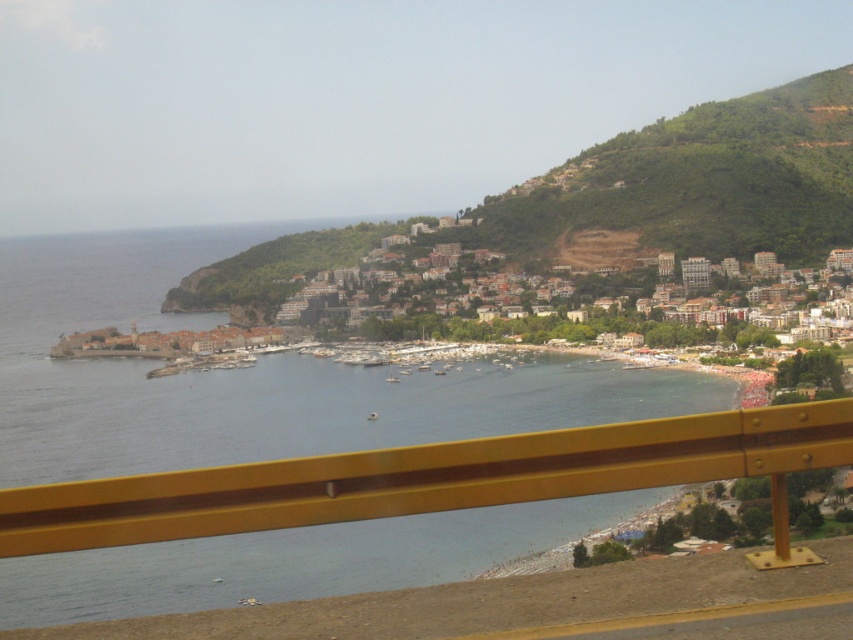
You are a photographer standing at the viewpoint with a wide angle lens. You want to capture both the yellow metallic rail at lower center and the brown stone buildings at center in the same frame. Considering their sizes, which object will appear smaller in the photo?

The yellow metallic rail at lower center will appear smaller in the photo because its width is less than the brown stone buildings at center.

You are standing at the viewpoint looking out at the coastal scene. Which object is closer to you between the yellow metallic rail at lower center and the brown stone buildings at center?

The yellow metallic rail at lower center is closer to you because it is positioned under the brown stone buildings at center, placing it in the foreground of the scene.

In the scene shown: You are a drone operator tasked with capturing aerial footage of the coastal town. Your drone is currently hovering above the yellow metallic rail at lower center. To ensure safety, your drone must maintain a minimum distance of 600 meters from any structures. Can you safely fly your drone towards the brown stone buildings at center without violating the safety distance?

The yellow metallic rail at lower center and brown stone buildings at center are 620.47 meters apart. Since the required safety distance is 600 meters, the drone can safely fly towards the brown stone buildings at center as the distance exceeds the minimum requirement.